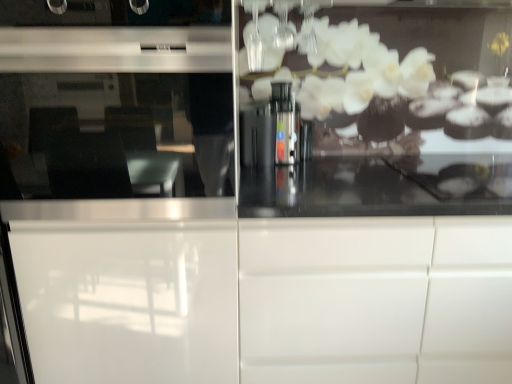
The width and height of the screenshot is (512, 384). Describe the element at coordinates (376, 300) in the screenshot. I see `white glossy cabinet at center` at that location.

At what (x,y) coordinates should I click in order to perform the action: click on white glossy cabinet at center. Please return your answer as a coordinate pair (x, y). Looking at the image, I should click on (376, 300).

Find the location of a particular element. The width and height of the screenshot is (512, 384). white glossy screen door at center is located at coordinates [118, 193].

What is the approximate width of white glossy screen door at center?

white glossy screen door at center is 26.76 inches in width.

The height and width of the screenshot is (384, 512). What do you see at coordinates (118, 193) in the screenshot? I see `white glossy screen door at center` at bounding box center [118, 193].

Locate an element on the screen. Image resolution: width=512 pixels, height=384 pixels. white glossy cabinet at center is located at coordinates (376, 300).

Considering the positions of objects white glossy cabinet at center and white glossy screen door at center in the image provided, who is more to the right, white glossy cabinet at center or white glossy screen door at center?

white glossy cabinet at center is more to the right.

Which object is more forward, white glossy cabinet at center or white glossy screen door at center?

white glossy screen door at center is closer to the camera.

Which is nearer, (282, 244) or (193, 373)?

The point (282, 244) is closer.

From the image's perspective, which one is positioned lower, white glossy cabinet at center or white glossy screen door at center?

white glossy cabinet at center, from the image's perspective.

From a real-world perspective, relative to white glossy screen door at center, is white glossy cabinet at center vertically above or below?

From a real-world perspective, white glossy cabinet at center is physically below white glossy screen door at center.

Which object is wider, white glossy cabinet at center or white glossy screen door at center?

Wider between the two is white glossy screen door at center.

Between white glossy cabinet at center and white glossy screen door at center, which one has less height?

white glossy cabinet at center is shorter.

Is white glossy cabinet at center smaller than white glossy screen door at center?

Yes, white glossy cabinet at center is smaller than white glossy screen door at center.

Is white glossy cabinet at center inside or outside of white glossy screen door at center?

white glossy cabinet at center is not inside white glossy screen door at center, it's outside.

Is the surface of white glossy cabinet at center in direct contact with white glossy screen door at center?

There is a gap between white glossy cabinet at center and white glossy screen door at center.

Could you tell me if white glossy cabinet at center is turned towards white glossy screen door at center?

No, white glossy cabinet at center is not oriented towards white glossy screen door at center.

How many degrees apart are the facing directions of white glossy cabinet at center and white glossy screen door at center?

0.522 degrees separate the facing orientations of white glossy cabinet at center and white glossy screen door at center.

I want to click on cabinetry located on the right of white glossy screen door at center, so click(376, 300).

Between white glossy screen door at center and white glossy cabinet at center, which one appears on the right side from the viewer's perspective?

white glossy cabinet at center is more to the right.

From the picture: Considering the positions of objects white glossy screen door at center and white glossy cabinet at center in the image provided, who is in front, white glossy screen door at center or white glossy cabinet at center?

Positioned in front is white glossy screen door at center.

Between point (21, 108) and point (273, 315), which one is positioned behind?

Positioned behind is point (273, 315).

From the image's perspective, which is above, white glossy screen door at center or white glossy cabinet at center?

white glossy screen door at center appears higher in the image.

From a real-world perspective, is white glossy screen door at center on top of white glossy cabinet at center?

Yes, from a real-world perspective, white glossy screen door at center is above white glossy cabinet at center.

Considering the relative sizes of white glossy screen door at center and white glossy cabinet at center in the image provided, is white glossy screen door at center wider than white glossy cabinet at center?

Yes, white glossy screen door at center is wider than white glossy cabinet at center.

Considering the sizes of objects white glossy screen door at center and white glossy cabinet at center in the image provided, who is shorter, white glossy screen door at center or white glossy cabinet at center?

white glossy cabinet at center is shorter.

Is white glossy screen door at center bigger or smaller than white glossy cabinet at center?

Clearly, white glossy screen door at center is larger in size than white glossy cabinet at center.

Is white glossy screen door at center not within white glossy cabinet at center?

Indeed, white glossy screen door at center is completely outside white glossy cabinet at center.

Is white glossy screen door at center directly adjacent to white glossy cabinet at center?

No, white glossy screen door at center is not with white glossy cabinet at center.

Is white glossy screen door at center aimed at white glossy cabinet at center?

No, white glossy screen door at center is not facing towards white glossy cabinet at center.

Measure the distance between white glossy screen door at center and white glossy cabinet at center.

white glossy screen door at center and white glossy cabinet at center are 15.72 inches apart.

This screenshot has width=512, height=384. I want to click on screen door on the left of white glossy cabinet at center, so click(x=118, y=193).

This screenshot has height=384, width=512. Identify the location of screen door above the white glossy cabinet at center (from a real-world perspective). coord(118,193).

The width and height of the screenshot is (512, 384). I want to click on cabinetry on the right of the white glossy screen door at center, so click(376, 300).